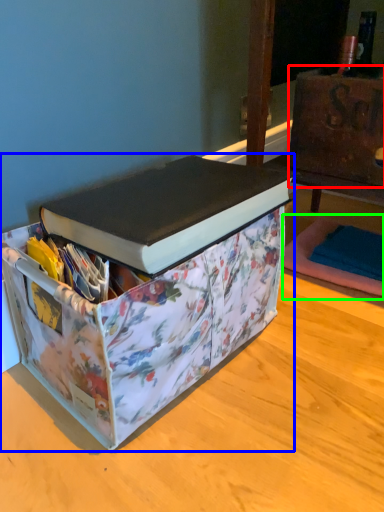
Question: Which object is the closest to the cardboard box (highlighted by a red box)? Choose among these: box (highlighted by a blue box) or yoga mat (highlighted by a green box).

Choices:
 (A) box
 (B) yoga mat

Answer: (B)